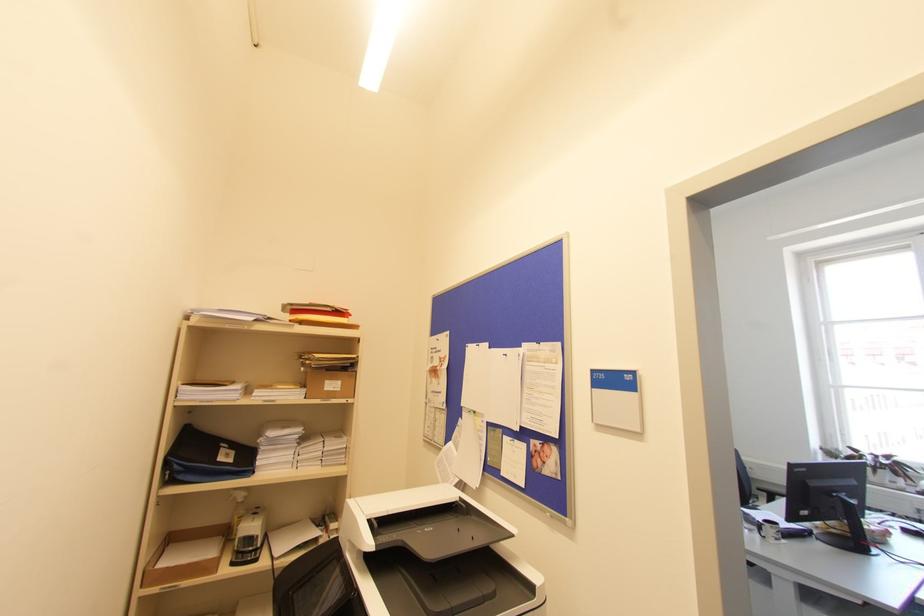
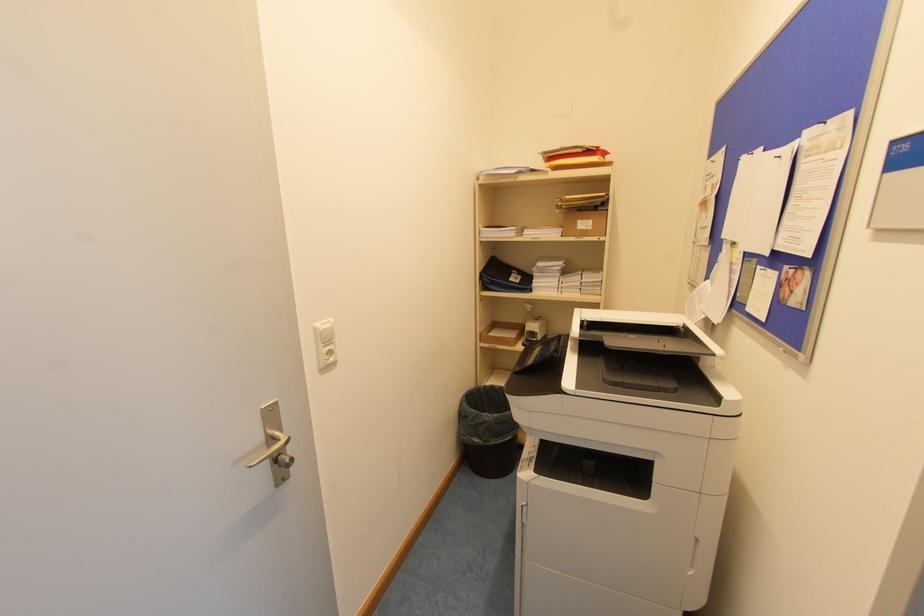
Where in the second image is the point corresponding to the point at 254,543 from the first image?

(536, 337)